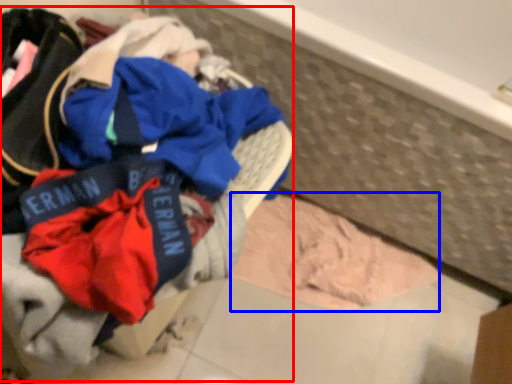
Question: Among these objects, which one is nearest to the camera, laundry (highlighted by a red box) or baby clothe (highlighted by a blue box)?

Choices:
 (A) laundry
 (B) baby clothe

Answer: (A)